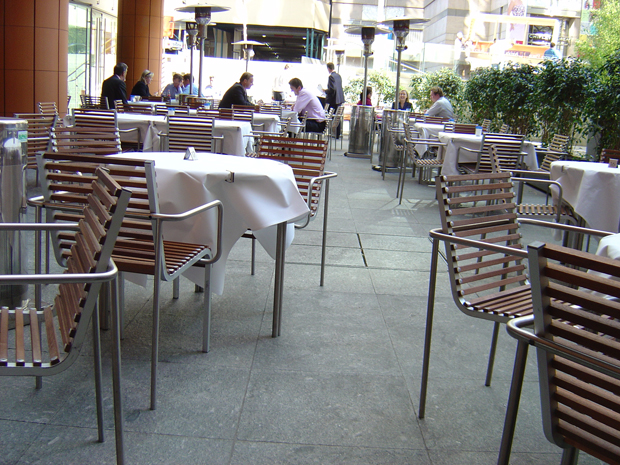
Identify the location of seated restaurant guests. This screenshot has width=620, height=465. (440, 106), (403, 101), (366, 100), (304, 101), (234, 94), (170, 89), (188, 84), (141, 87), (116, 87).